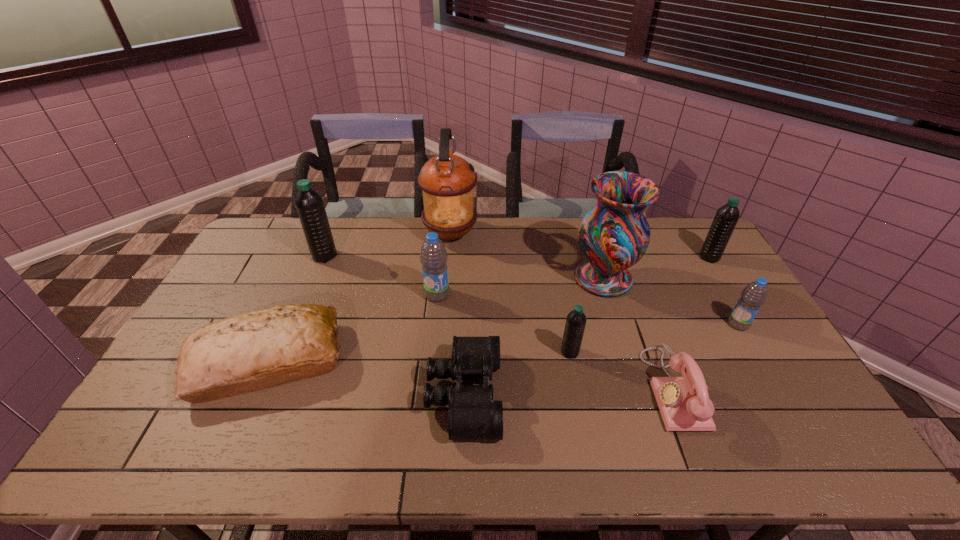
This screenshot has height=540, width=960. I want to click on oil lamp, so [x=447, y=181].

The height and width of the screenshot is (540, 960). I want to click on vase, so click(x=614, y=235).

Image resolution: width=960 pixels, height=540 pixels. What are the coordinates of `the biggest black water bottle` in the screenshot? It's located at (309, 204).

The image size is (960, 540). In order to click on the leftmost black water bottle in this screenshot , I will do point(309,204).

You are a GUI agent. You are given a task and a screenshot of the screen. Output one action in this format:
    pyautogui.click(x=<x>, y=<y>)
    Task: Click on the rightmost black water bottle
    This screenshot has height=540, width=960.
    Given the screenshot: What is the action you would take?
    pyautogui.click(x=727, y=216)

Identify the location of the fourth water bottle from right to left. (433, 257).

This screenshot has height=540, width=960. What are the coordinates of `the farther blue water bottle` in the screenshot? It's located at (433, 257).

Where is `the fifth object from right to left`? The image size is (960, 540). the fifth object from right to left is located at coordinates (575, 324).

The image size is (960, 540). Find the location of `the third water bottle from right to left`. the third water bottle from right to left is located at coordinates (575, 324).

The height and width of the screenshot is (540, 960). Identify the location of the fourth farthest water bottle. (754, 295).